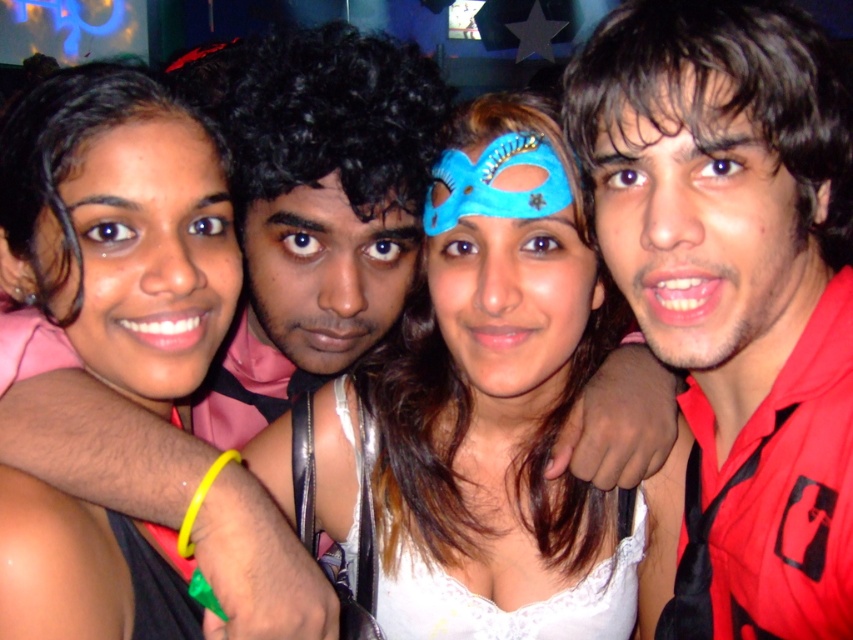
Who is taller, brown matte face at right or matte black face at center?

With more height is brown matte face at right.

Who is positioned more to the right, brown matte face at right or matte black face at center?

Positioned to the right is brown matte face at right.

What do you see at coordinates (704, 234) in the screenshot?
I see `brown matte face at right` at bounding box center [704, 234].

Identify the location of brown matte face at right. This screenshot has width=853, height=640. (704, 234).

Is brown matte face at right bigger than blue velvet mask at center?

Correct, brown matte face at right is larger in size than blue velvet mask at center.

Is brown matte face at right behind blue velvet mask at center?

No, brown matte face at right is in front of blue velvet mask at center.

The width and height of the screenshot is (853, 640). What do you see at coordinates (704, 234) in the screenshot?
I see `brown matte face at right` at bounding box center [704, 234].

Where is `brown matte face at right`? This screenshot has width=853, height=640. brown matte face at right is located at coordinates (704, 234).

Is white satin dress at center above matte pink skin at left?

Yes, white satin dress at center is above matte pink skin at left.

Is white satin dress at center closer to the viewer compared to matte pink skin at left?

No, it is not.

Does point (225, 609) come closer to viewer compared to point (126, 220)?

Yes, it is in front of point (126, 220).

I want to click on white satin dress at center, so coord(99,445).